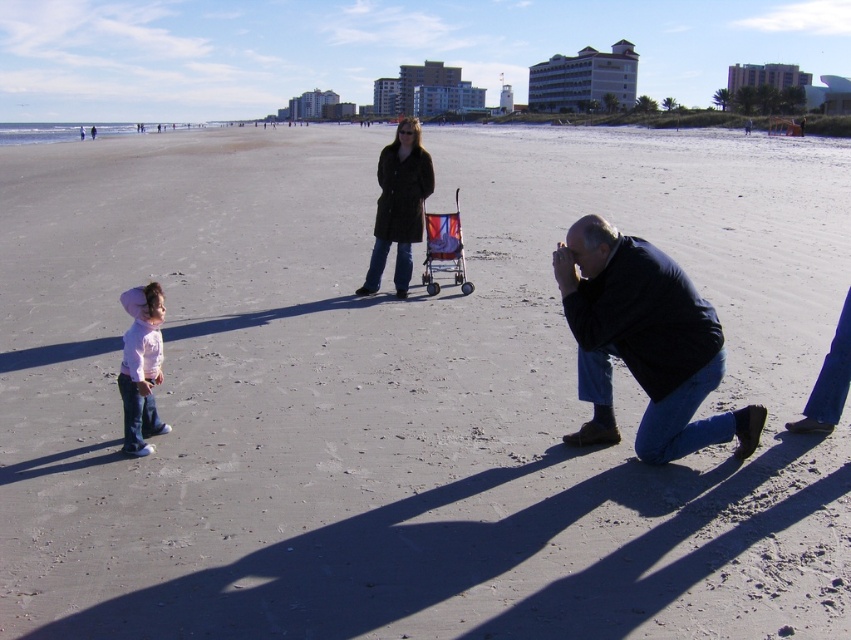
You are a photographer positioned at the center of the beach scene. You want to take a photo of both the dark blue jacket at lower right and the pink matte shirt at lower left. Which object should you focus on first to ensure both are in clear view?

The dark blue jacket at lower right is closer to the viewer than the pink matte shirt at lower left, so you should focus on the dark blue jacket at lower right first to ensure both are in clear view.

You are a photographer trying to capture a photo of both the dark brown coat at center and the pink matte shirt at lower left in the same frame. Based on their heights, which object will appear larger in the photo?

The dark brown coat at center will appear larger in the photo because it has a greater height compared to the pink matte shirt at lower left.